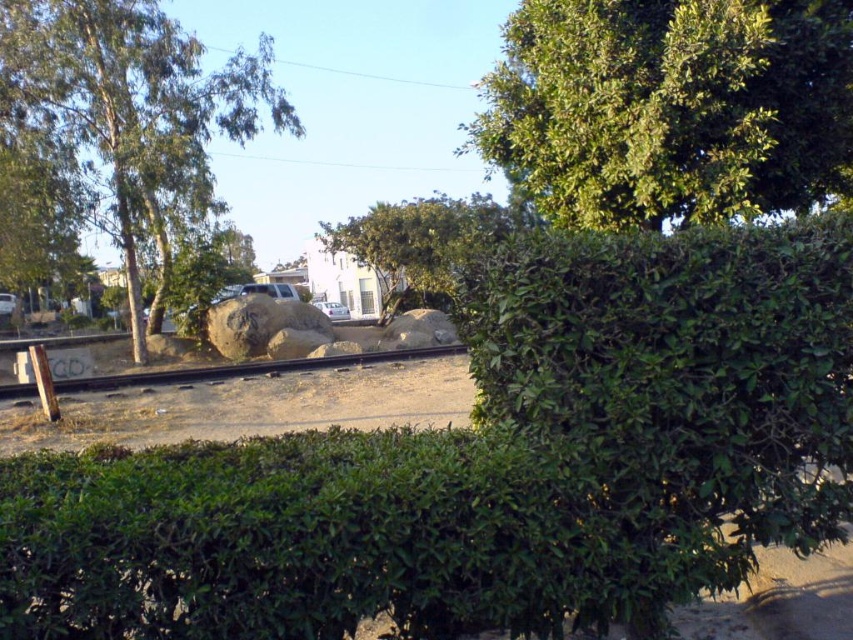
Does green leafy hedge at center have a lesser height compared to white matte car at center?

No.

Is green leafy hedge at center above white matte car at center?

No, green leafy hedge at center is not above white matte car at center.

Does point (672, 400) come in front of point (334, 320)?

Yes, point (672, 400) is in front of point (334, 320).

This screenshot has height=640, width=853. In order to click on green leafy hedge at center in this screenshot , I will do `click(489, 465)`.

Is the position of green leafy hedge at center less distant than that of green leafy tree at center?

Yes.

Is green leafy hedge at center smaller than green leafy tree at center?

Indeed, green leafy hedge at center has a smaller size compared to green leafy tree at center.

Is point (85, 634) positioned before point (386, 253)?

Yes.

The image size is (853, 640). I want to click on green leafy hedge at center, so click(489, 465).

Is green leafy tree at center thinner than white matte car at center?

Incorrect, green leafy tree at center's width is not less than white matte car at center's.

Is point (392, 282) positioned behind point (323, 310)?

No, (392, 282) is in front of (323, 310).

This screenshot has width=853, height=640. I want to click on green leafy tree at center, so click(x=418, y=246).